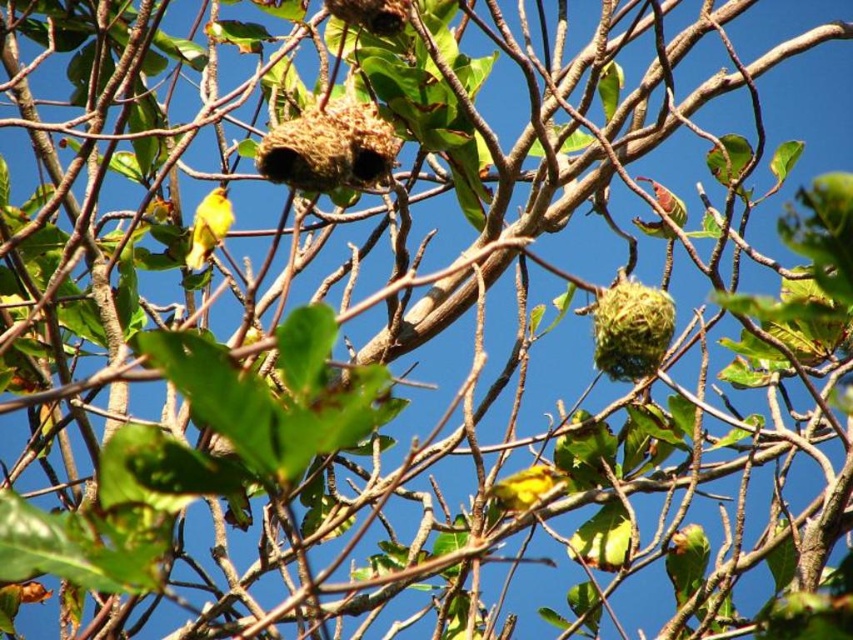
You are a birder observing a tree with two bird nests. You notice a yellow matte bird at left. Based on its position, which nest is it likely perched near?

The yellow matte bird at left is located at point (207, 227), which is closer to the lower nest on the right side. Therefore, the yellow matte bird at left is likely perched near the lower nest on the right side.

In the scene shown: You are a birdwatcher observing the tree with two bird nests. You notice a yellow matte bird at left and a green matte bird at upper right. Which bird is taller?

The yellow matte bird at left is much taller than the green matte bird at upper right.

You are a birdwatcher observing the tree. You notice a yellow matte bird at left and a green matte bird at upper right. Which bird is positioned more to the left side of the tree?

The yellow matte bird at left is positioned more to the left side of the tree than the green matte bird at upper right.